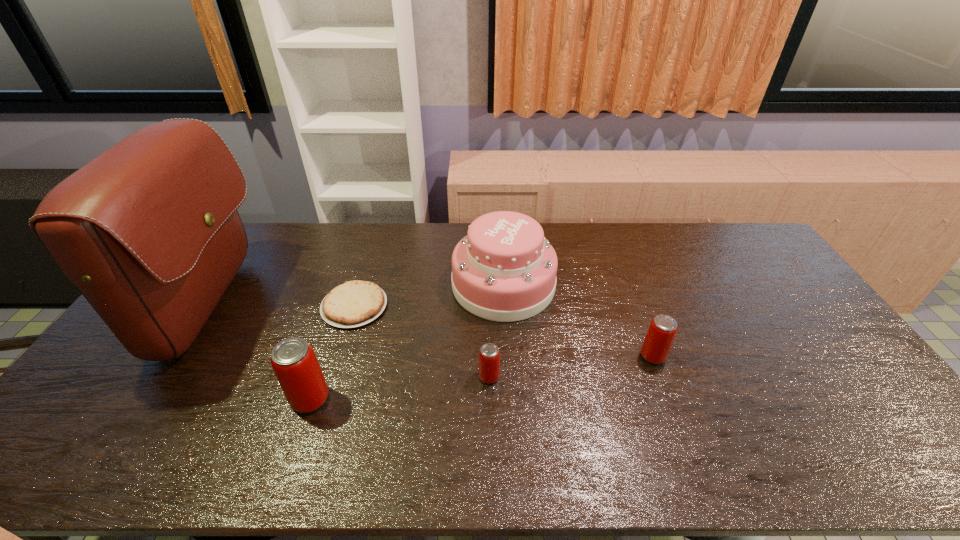
The height and width of the screenshot is (540, 960). Find the location of `vacant region between the fourth shortest object and the second beer can from left to right`. vacant region between the fourth shortest object and the second beer can from left to right is located at coordinates (399, 388).

Locate an element on the screen. vacant region between the second beer can from right to left and the shortest object is located at coordinates (421, 341).

The image size is (960, 540). Identify the location of vacant point located between the third tallest object and the fifth tallest object. (399, 388).

Locate an element on the screen. This screenshot has height=540, width=960. unoccupied position between the rightmost object and the tortilla is located at coordinates (504, 331).

Image resolution: width=960 pixels, height=540 pixels. I want to click on vacant area that lies between the leftmost object and the rightmost beer can, so click(x=432, y=332).

Select which object appears as the second closest to the fifth shortest object. Please provide its 2D coordinates. Your answer should be formatted as a tuple, i.e. [(x, y)], where the tuple contains the x and y coordinates of a point satisfying the conditions above.

[(355, 303)]

In order to click on the third closest object to the fifth shortest object in this screenshot , I will do click(x=660, y=336).

Locate which beer can is the third closest to the second tallest object. Please provide its 2D coordinates. Your answer should be formatted as a tuple, i.e. [(x, y)], where the tuple contains the x and y coordinates of a point satisfying the conditions above.

[(294, 362)]

The image size is (960, 540). What are the coordinates of `beer can that is the closest to the leftmost object` in the screenshot? It's located at (294, 362).

At what (x,y) coordinates should I click in order to perform the action: click on free space that satisfies the following two spatial constraints: 1. on the back side of the second tallest beer can; 2. on the left side of the leftmost beer can. Please return your answer as a coordinate pair (x, y). The image size is (960, 540). Looking at the image, I should click on (324, 356).